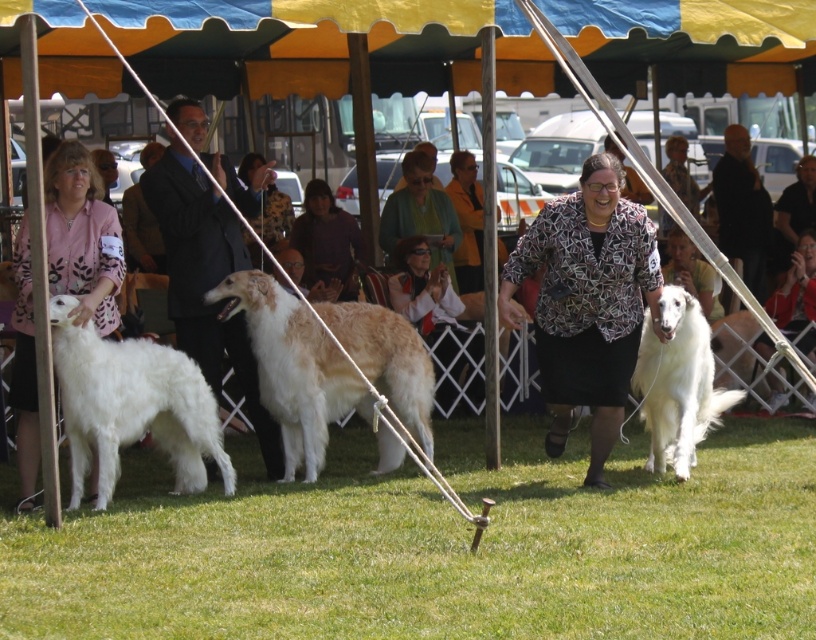
You are a photographer at the dog show and need to frame a photo that includes both the dark suit at center and the white fluffy dog at center. Which one should you adjust your camera angle to focus on first if you want to ensure both fit in the frame?

The dark suit at center is wider than the white fluffy dog at center, so you should focus on the dark suit at center first to ensure both fit in the frame.

You are a photographer at the dog show. You want to take a photo that includes both the dark suit at center and the white fluffy dog at center. Which one should you focus on first if you want to ensure both are in focus?

The dark suit at center has a greater height compared to the white fluffy dog at center, so you should focus on the dark suit at center first to ensure both are in focus.